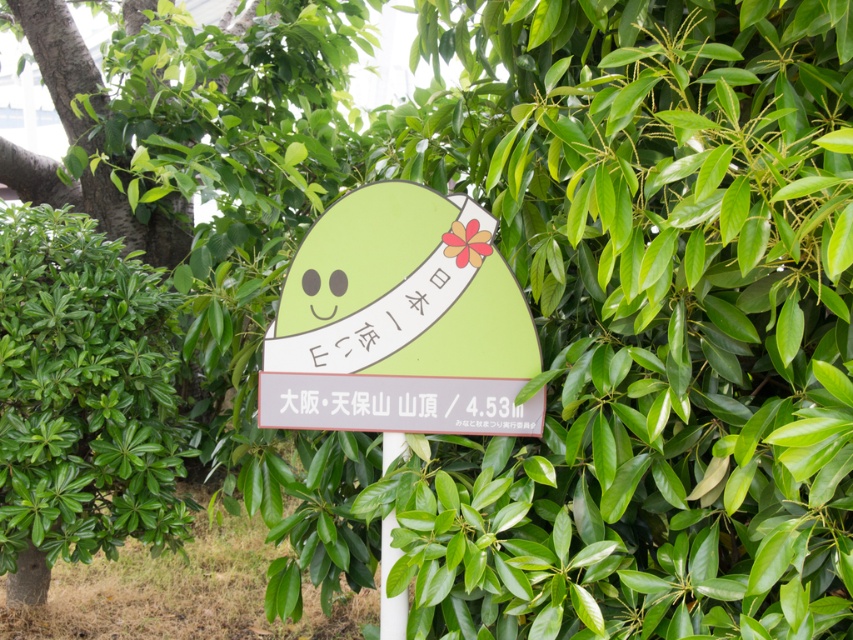
Identify the location of green matte sign at center. (399, 323).

In the scene shown: Between green matte sign at center and white plastic pole at center, which one is positioned higher?

green matte sign at center

The width and height of the screenshot is (853, 640). Describe the element at coordinates (399, 323) in the screenshot. I see `green matte sign at center` at that location.

At what (x,y) coordinates should I click in order to perform the action: click on green matte sign at center. Please return your answer as a coordinate pair (x, y). Image resolution: width=853 pixels, height=640 pixels. Looking at the image, I should click on 399,323.

Which is in front, point (152, 536) or point (440, 371)?

Point (440, 371) is in front.

Does point (10, 241) come in front of point (526, 362)?

No, (10, 241) is behind (526, 362).

Where is `green leafy hedge at left`? This screenshot has width=853, height=640. green leafy hedge at left is located at coordinates (82, 400).

I want to click on green leafy hedge at left, so click(x=82, y=400).

In order to click on green leafy hedge at left in this screenshot , I will do `click(82, 400)`.